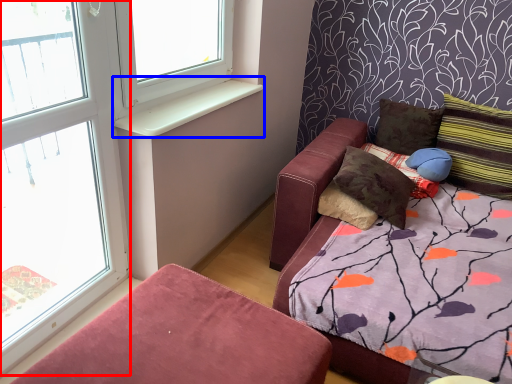
Question: Which object appears closest to the camera in this image, window frame (highlighted by a red box) or window sill (highlighted by a blue box)?

Choices:
 (A) window frame
 (B) window sill

Answer: (A)